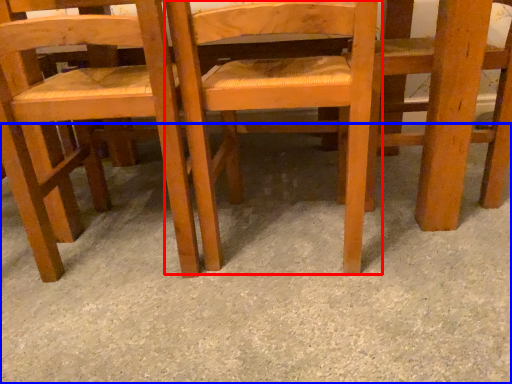
Question: Among these objects, which one is nearest to the camera, chair (highlighted by a red box) or concrete (highlighted by a blue box)?

Choices:
 (A) chair
 (B) concrete

Answer: (B)